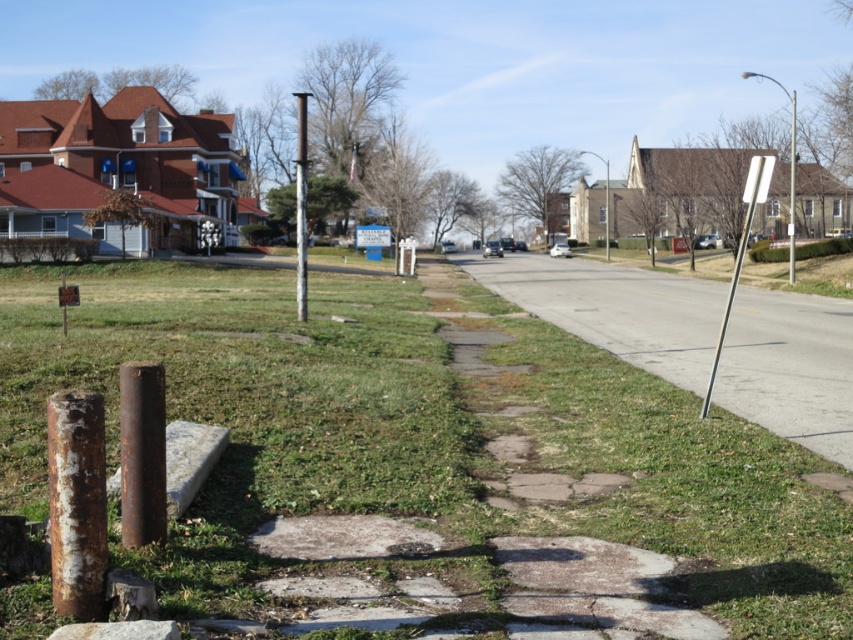
Where is `green grass at lower center`? The image size is (853, 640). green grass at lower center is located at coordinates (424, 461).

Does green grass at lower center have a greater height compared to gray asphalt road at center?

Incorrect, green grass at lower center's height is not larger of gray asphalt road at center's.

Locate an element on the screen. green grass at lower center is located at coordinates pyautogui.click(x=424, y=461).

Describe the element at coordinates (741, 250) in the screenshot. I see `silver metallic signpost at right` at that location.

Is silver metallic signpost at right to the left of rusty metal pole at center from the viewer's perspective?

In fact, silver metallic signpost at right is to the right of rusty metal pole at center.

Between point (737, 256) and point (302, 136), which one is positioned in front?

Point (302, 136)

What are the coordinates of `silver metallic signpost at right` in the screenshot? It's located at (741, 250).

Who is shorter, gray asphalt road at center or metallic pole at right?

gray asphalt road at center is shorter.

Based on the photo, who is more forward, (637, 300) or (793, 154)?

Point (637, 300) is more forward.

This screenshot has width=853, height=640. I want to click on gray asphalt road at center, so click(x=614, y=308).